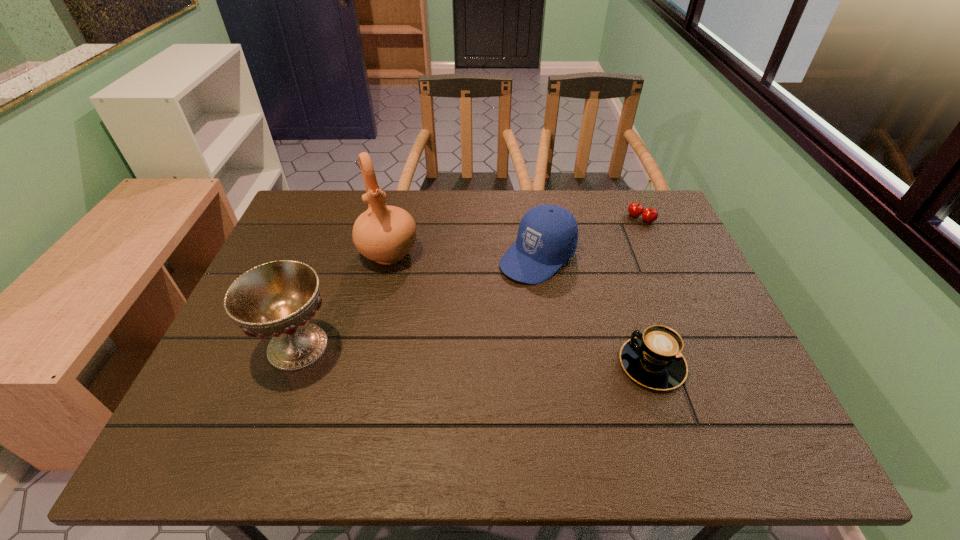
Locate an element on the screen. free space on the desktop that is between the chalice and the cappuccino and is positioned with the stems of the cherry pointing upwards is located at coordinates (511, 356).

Where is `free space on the desktop that is between the chalice and the second object from right to left and is positioned on the spout of the tallest object`? The height and width of the screenshot is (540, 960). free space on the desktop that is between the chalice and the second object from right to left and is positioned on the spout of the tallest object is located at coordinates (421, 352).

Where is `free space on the desktop that is between the chalice and the cappuccino and is positioned on the front-facing side of the third object from right to left`? This screenshot has width=960, height=540. free space on the desktop that is between the chalice and the cappuccino and is positioned on the front-facing side of the third object from right to left is located at coordinates (421, 352).